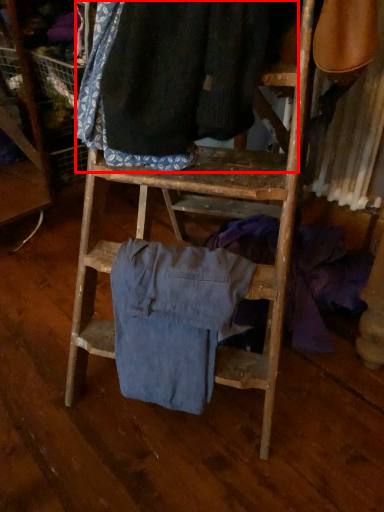
Question: From the image, what is the correct spatial relationship of clothing (annotated by the red box) in relation to clothing?

Choices:
 (A) left
 (B) right

Answer: (B)